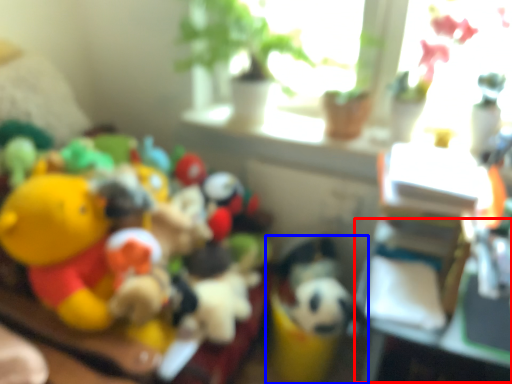
Question: Which point is further to the camera, table (highlighted by a red box) or toy (highlighted by a blue box)?

Choices:
 (A) table
 (B) toy

Answer: (B)